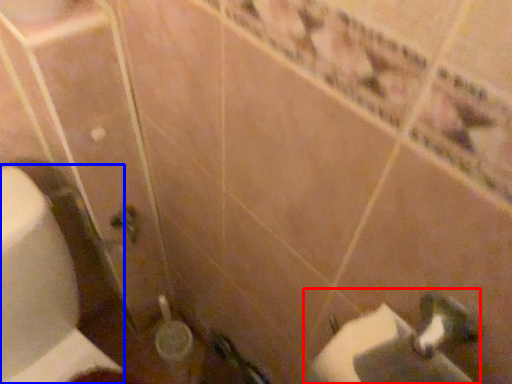
Question: Which object is further to the camera taking this photo, sink (highlighted by a red box) or toilet paper (highlighted by a blue box)?

Choices:
 (A) sink
 (B) toilet paper

Answer: (B)